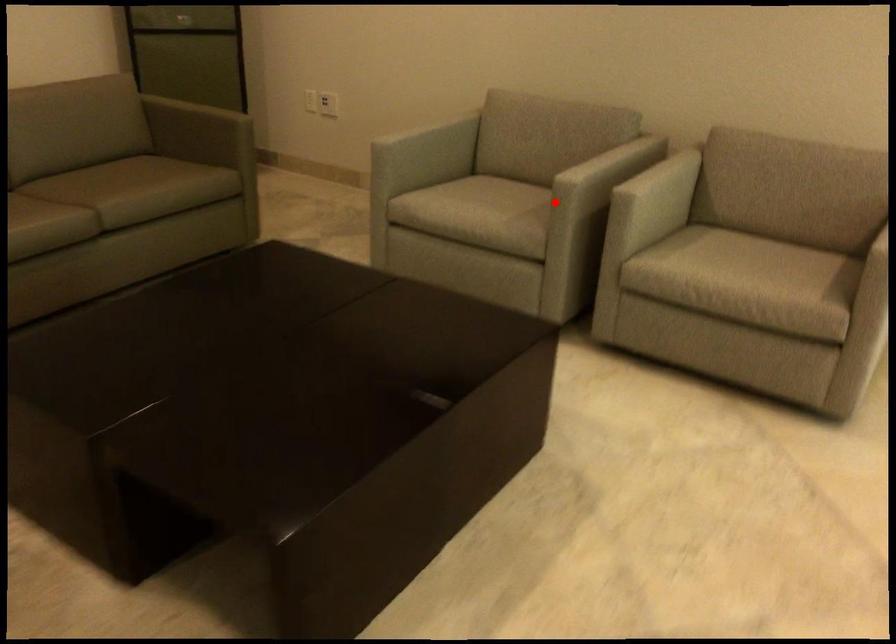
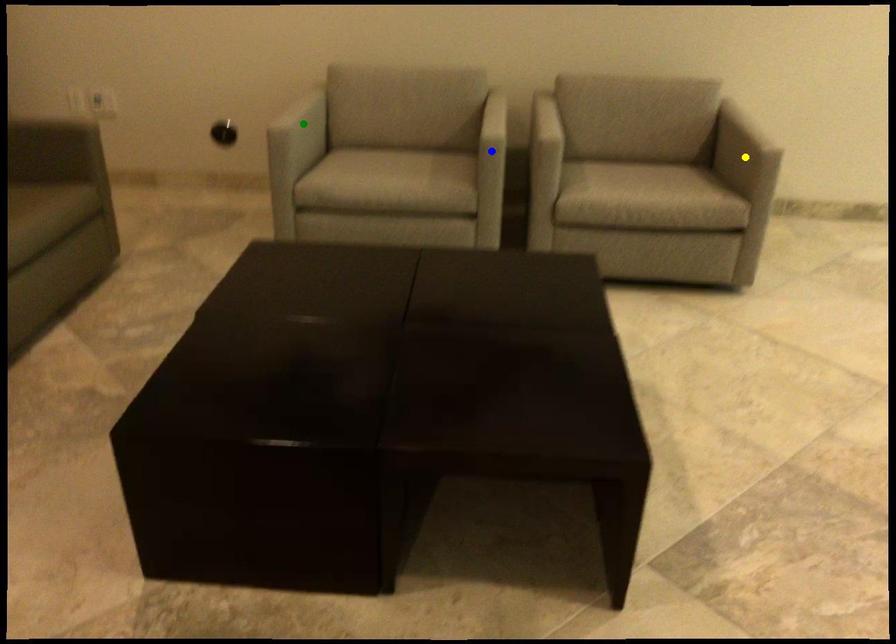
Question: I am providing you with two images of the same scene from different viewpoints. A red point is marked on the first image. You are given multiple points on the second image. Which point in image 2 represents the same 3d spot as the red point in image 1?

Choices:
 (A) blue point
 (B) green point
 (C) yellow point

Answer: (A)